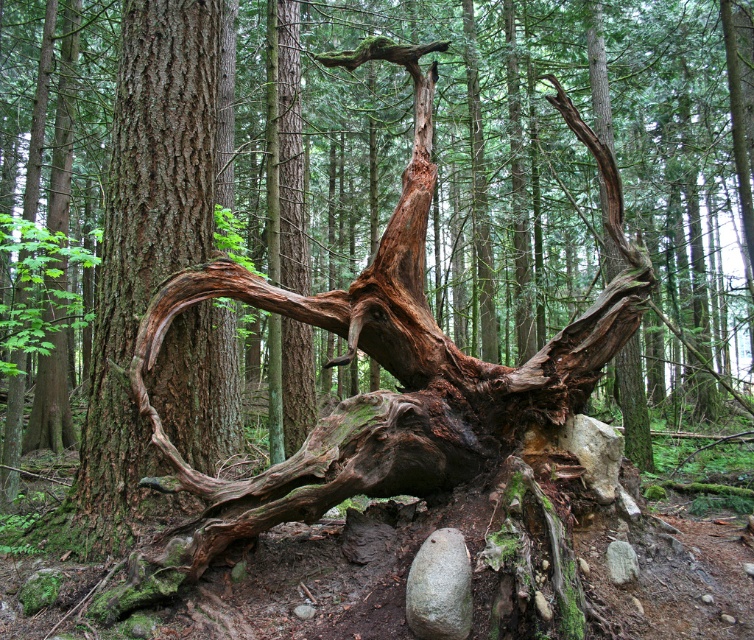
How much distance is there between rough bark tree trunk at center and gray rough rock at lower center?

rough bark tree trunk at center and gray rough rock at lower center are 4.51 feet apart.

Which of these two, rough bark tree trunk at center or gray rough rock at lower center, stands taller?

With more height is rough bark tree trunk at center.

Which is behind, point (118, 177) or point (420, 554)?

The point (118, 177) is more distant.

I want to click on rough bark tree trunk at center, so click(143, 253).